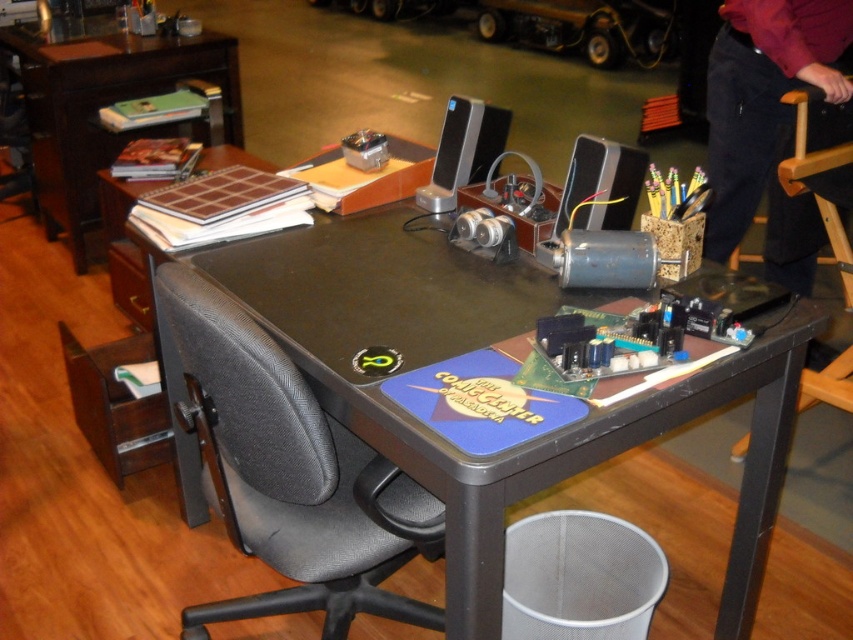
Question: Which point is closer to the camera?

Choices:
 (A) (44, 150)
 (B) (802, 196)
 (C) (601, 150)
 (D) (277, 448)

Answer: (D)

Question: Considering the real-world distances, which object is farthest from the black textured swivel chair at left?

Choices:
 (A) wooden chair at right
 (B) brown wood table at upper left
 (C) black plastic table at center

Answer: (B)

Question: Does metallic gray speaker at center appear on the left side of satin silver speaker at center?

Choices:
 (A) no
 (B) yes

Answer: (A)

Question: From the image, what is the correct spatial relationship of wooden chair at right in relation to satin silver speaker at center?

Choices:
 (A) right
 (B) left

Answer: (A)

Question: Which object appears farthest from the camera in this image?

Choices:
 (A) black textured swivel chair at left
 (B) dark blue jeans at lower right
 (C) black plastic table at center

Answer: (B)

Question: Does black textured swivel chair at left appear on the left side of metallic gray speaker at center?

Choices:
 (A) no
 (B) yes

Answer: (B)